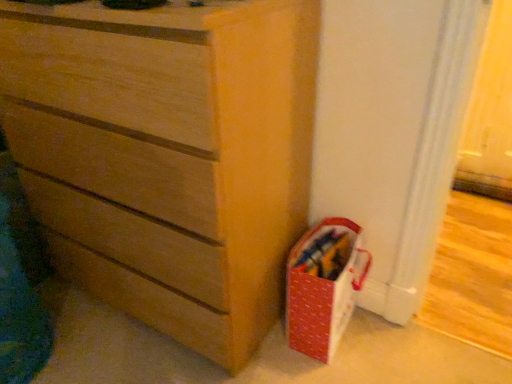
Question: Does red fabric basket at lower right have a smaller size compared to matte wood chest of drawers at center?

Choices:
 (A) no
 (B) yes

Answer: (B)

Question: Is red fabric basket at lower right taller than matte wood chest of drawers at center?

Choices:
 (A) yes
 (B) no

Answer: (B)

Question: From the image's perspective, is red fabric basket at lower right on top of matte wood chest of drawers at center?

Choices:
 (A) yes
 (B) no

Answer: (B)

Question: Can you confirm if red fabric basket at lower right is wider than matte wood chest of drawers at center?

Choices:
 (A) no
 (B) yes

Answer: (A)

Question: Is the surface of red fabric basket at lower right in direct contact with matte wood chest of drawers at center?

Choices:
 (A) no
 (B) yes

Answer: (A)

Question: Is red fabric basket at lower right facing towards matte wood chest of drawers at center?

Choices:
 (A) yes
 (B) no

Answer: (B)

Question: Does matte wood chest of drawers at center have a smaller size compared to red fabric basket at lower right?

Choices:
 (A) yes
 (B) no

Answer: (B)

Question: Is matte wood chest of drawers at center next to red fabric basket at lower right?

Choices:
 (A) no
 (B) yes

Answer: (A)

Question: Considering the relative sizes of matte wood chest of drawers at center and red fabric basket at lower right in the image provided, is matte wood chest of drawers at center wider than red fabric basket at lower right?

Choices:
 (A) no
 (B) yes

Answer: (B)

Question: Is matte wood chest of drawers at center bigger than red fabric basket at lower right?

Choices:
 (A) no
 (B) yes

Answer: (B)

Question: Considering the relative sizes of matte wood chest of drawers at center and red fabric basket at lower right in the image provided, is matte wood chest of drawers at center taller than red fabric basket at lower right?

Choices:
 (A) no
 (B) yes

Answer: (B)

Question: Are matte wood chest of drawers at center and red fabric basket at lower right far apart?

Choices:
 (A) no
 (B) yes

Answer: (A)

Question: From a real-world perspective, is red fabric basket at lower right positioned above or below matte wood chest of drawers at center?

Choices:
 (A) above
 (B) below

Answer: (B)